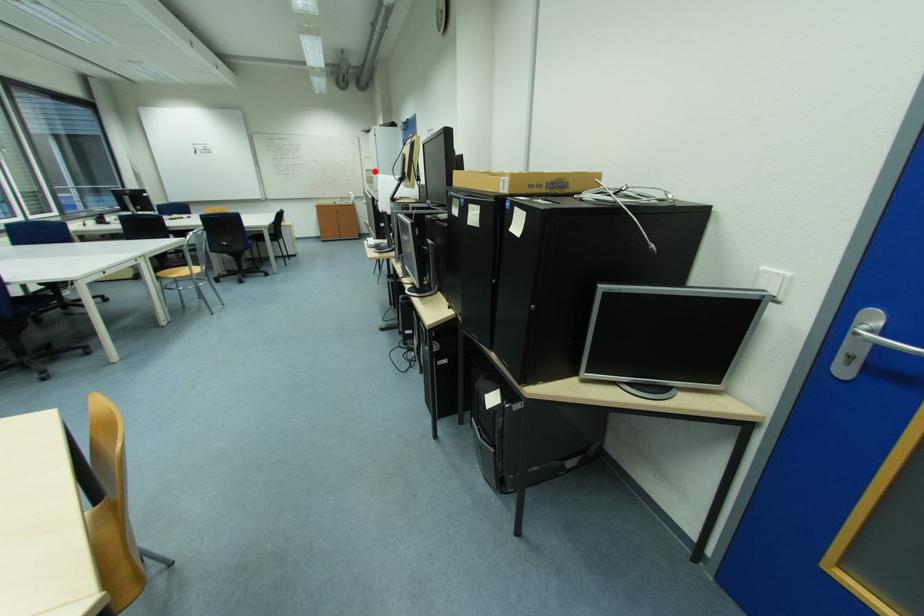
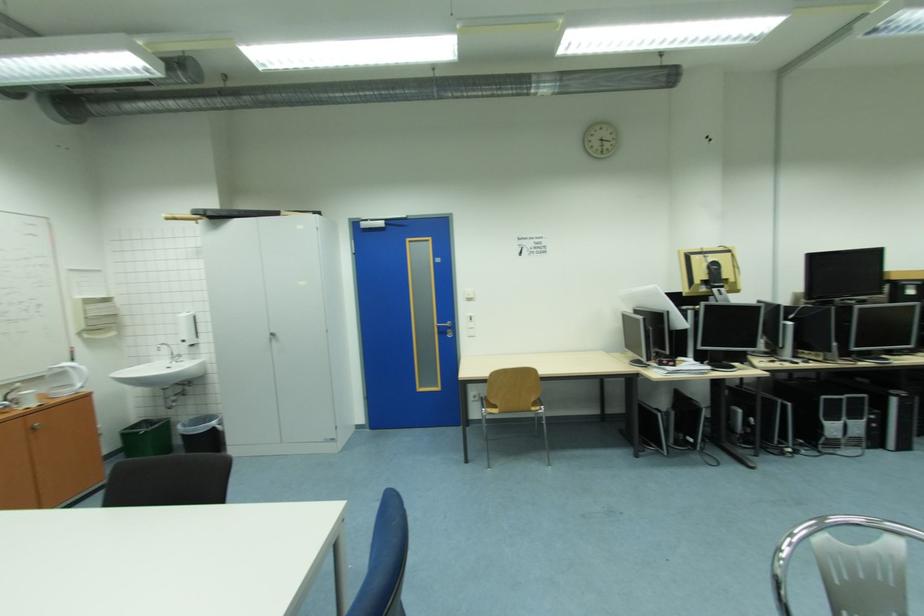
Question: I am providing you with two images of the same scene from different viewpoints. A red point is shown in image1. For the corresponding object point in image2, is it positioned nearer or farther from the camera?

Choices:
 (A) Nearer
 (B) Farther

Answer: (B)